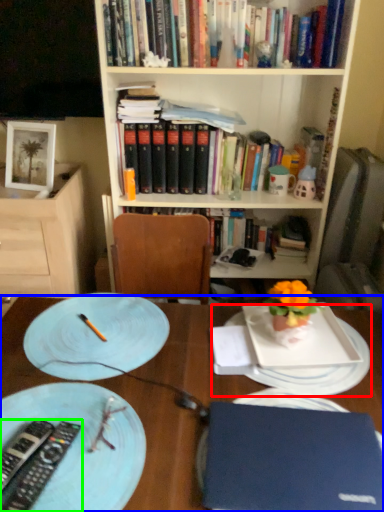
Question: Which is nearer to the platter (highlighted by a red box)? desk (highlighted by a blue box) or remote control (highlighted by a green box).

Choices:
 (A) desk
 (B) remote control

Answer: (A)